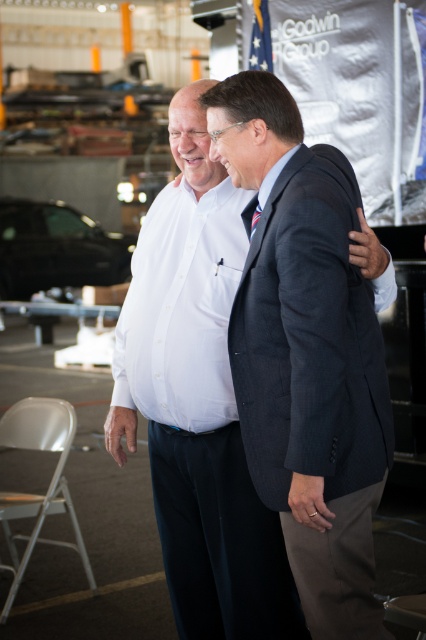
Question: Does shiny black car at center appear on the right side of striped silk tie at center?

Choices:
 (A) yes
 (B) no

Answer: (B)

Question: Can you confirm if shiny black car at center is smaller than striped silk tie at center?

Choices:
 (A) no
 (B) yes

Answer: (A)

Question: Among these objects, which one is nearest to the camera?

Choices:
 (A) white shirt at center
 (B) striped silk tie at center
 (C) shiny black car at center

Answer: (A)

Question: Estimate the real-world distances between objects in this image. Which object is closer to the white shirt at center?

Choices:
 (A) striped silk tie at center
 (B) shiny black car at center

Answer: (A)

Question: Is white shirt at center further to the viewer compared to striped silk tie at center?

Choices:
 (A) no
 (B) yes

Answer: (A)

Question: Which object is positioned farthest from the white shirt at center?

Choices:
 (A) shiny black car at center
 (B) striped silk tie at center

Answer: (A)